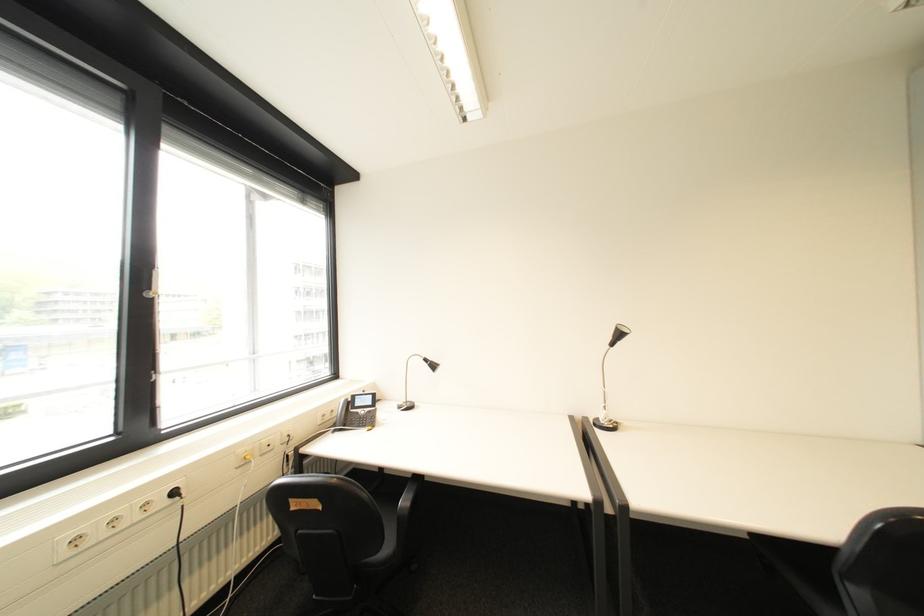
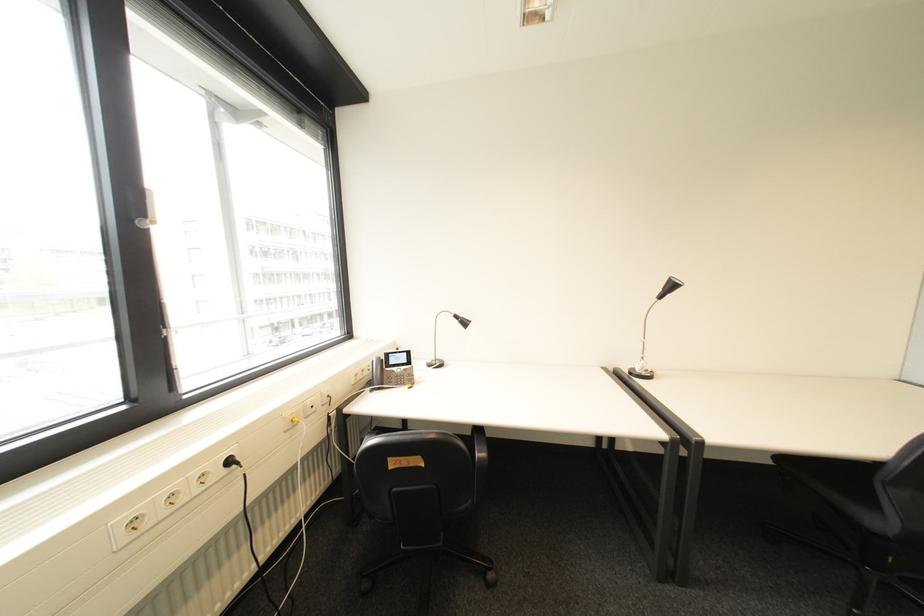
Question: Based on the continuous images, in which direction is the camera rotating? Reply with the corresponding letter.

Choices:
 (A) Left
 (B) Right
 (C) Up
 (D) Down

Answer: (D)